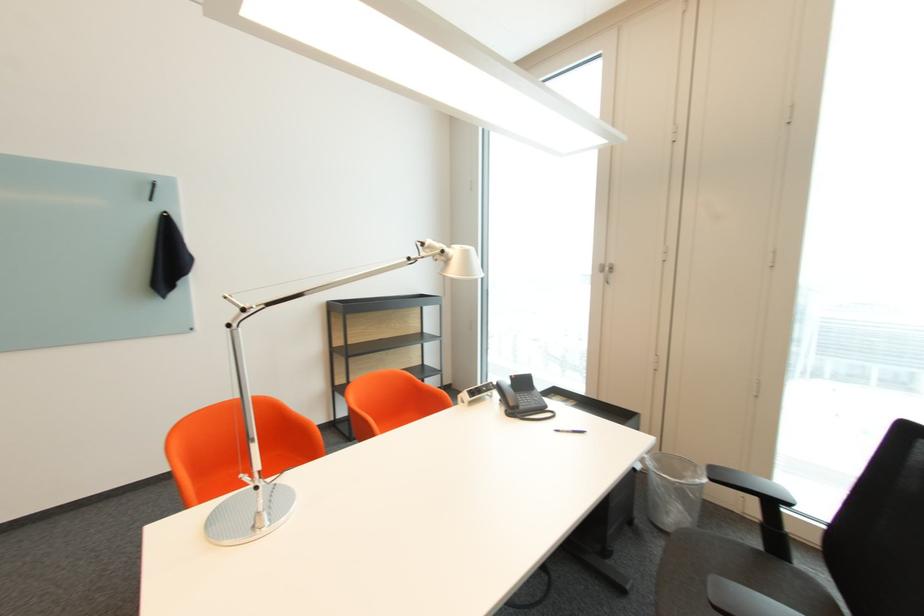
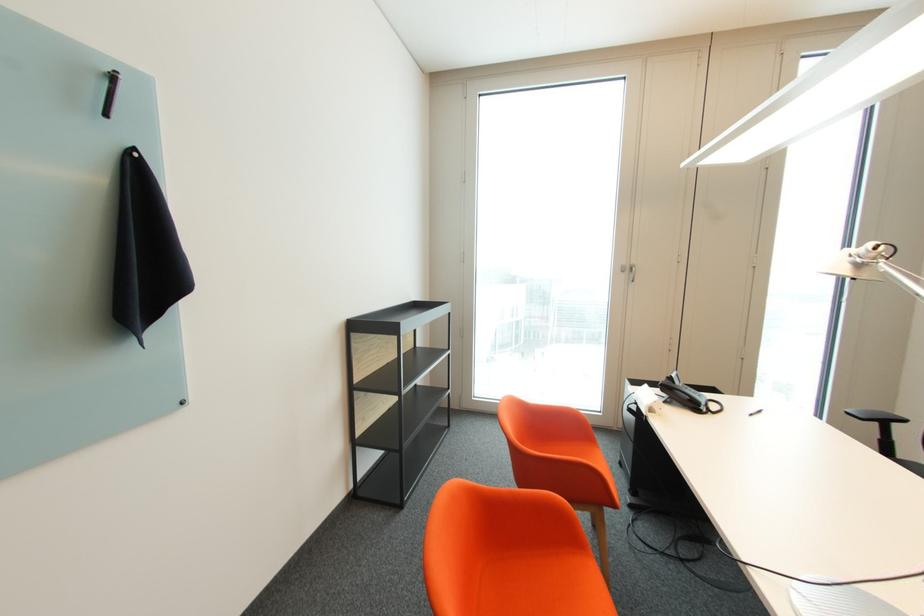
Locate, in the second image, the point that corresponds to pixel 611 272 in the first image.

(629, 272)